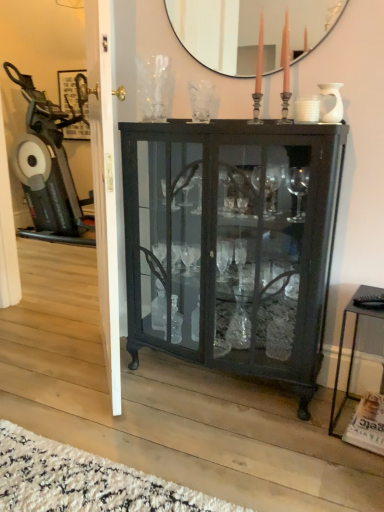
Find the location of a particular element. Image resolution: width=384 pixels, height=512 pixels. free space below white glossy door at center (from a real-world perspective) is located at coordinates (104, 377).